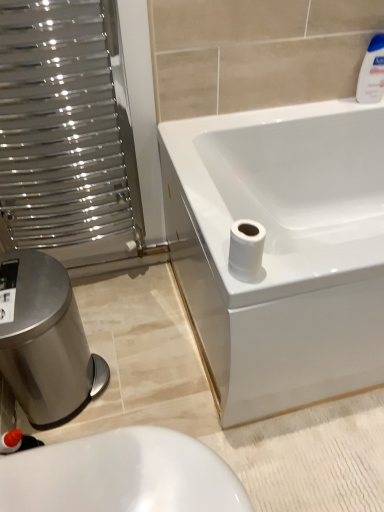
Question: Does metallic silver radiator at left have a smaller size compared to white matte toilet paper at lower right?

Choices:
 (A) yes
 (B) no

Answer: (B)

Question: Would you say white matte toilet paper at lower right is part of metallic silver radiator at left's contents?

Choices:
 (A) yes
 (B) no

Answer: (B)

Question: From a real-world perspective, is metallic silver radiator at left beneath white matte toilet paper at lower right?

Choices:
 (A) no
 (B) yes

Answer: (B)

Question: Considering the relative sizes of metallic silver radiator at left and white matte toilet paper at lower right in the image provided, is metallic silver radiator at left wider than white matte toilet paper at lower right?

Choices:
 (A) no
 (B) yes

Answer: (B)

Question: Is metallic silver radiator at left located outside white matte toilet paper at lower right?

Choices:
 (A) no
 (B) yes

Answer: (B)

Question: In terms of height, does white matte toilet paper at lower right look taller or shorter compared to white glossy bottle at upper right?

Choices:
 (A) short
 (B) tall

Answer: (A)

Question: In the image, is white matte toilet paper at lower right on the left side or the right side of white glossy bottle at upper right?

Choices:
 (A) left
 (B) right

Answer: (A)

Question: In terms of width, does white matte toilet paper at lower right look wider or thinner when compared to white glossy bottle at upper right?

Choices:
 (A) wide
 (B) thin

Answer: (A)

Question: From a real-world perspective, is white matte toilet paper at lower right physically located above or below white glossy bottle at upper right?

Choices:
 (A) below
 (B) above

Answer: (A)

Question: In the image, is white glossy bathtub at upper right positioned in front of or behind white glossy bottle at upper right?

Choices:
 (A) front
 (B) behind

Answer: (A)

Question: From a real-world perspective, relative to white glossy bottle at upper right, is white glossy bathtub at upper right vertically above or below?

Choices:
 (A) below
 (B) above

Answer: (A)

Question: Visually, is white glossy bathtub at upper right positioned to the left or to the right of white glossy bottle at upper right?

Choices:
 (A) left
 (B) right

Answer: (A)

Question: Is white glossy bathtub at upper right inside the boundaries of white glossy bottle at upper right, or outside?

Choices:
 (A) outside
 (B) inside

Answer: (A)

Question: Do you think white glossy bathtub at upper right is within white glossy toilet at lower left, or outside of it?

Choices:
 (A) outside
 (B) inside

Answer: (A)

Question: Is point (316, 399) closer or farther from the camera than point (140, 438)?

Choices:
 (A) farther
 (B) closer

Answer: (A)